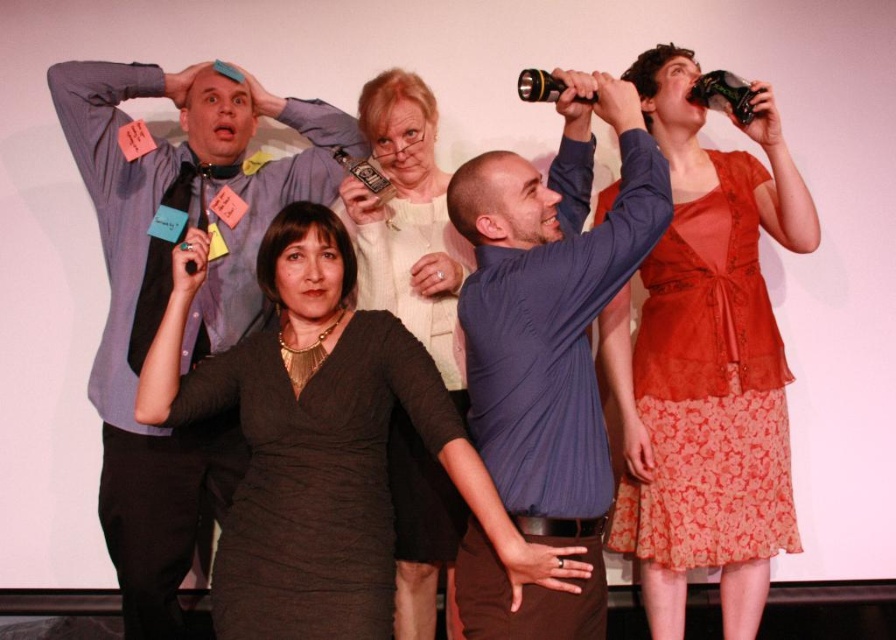
Question: Does matte black dress at center appear on the left side of matte white sweater at center?

Choices:
 (A) yes
 (B) no

Answer: (A)

Question: Where is matte black shirt at left located in relation to matte white sweater at center in the image?

Choices:
 (A) right
 (B) left

Answer: (B)

Question: Is matte black dress at center to the left of matte black shirt at left from the viewer's perspective?

Choices:
 (A) yes
 (B) no

Answer: (B)

Question: Which object appears closest to the camera in this image?

Choices:
 (A) matte orange blouse at upper right
 (B) matte black shirt at left
 (C) blue ribbed shirt at center
 (D) matte white sweater at center

Answer: (C)

Question: Which point appears farthest from the camera in this image?

Choices:
 (A) (395, 586)
 (B) (122, 481)
 (C) (455, 228)
 (D) (291, 237)

Answer: (A)

Question: Which point is farther to the camera?

Choices:
 (A) (216, 451)
 (B) (340, 371)
 (C) (403, 593)
 (D) (608, 253)

Answer: (C)